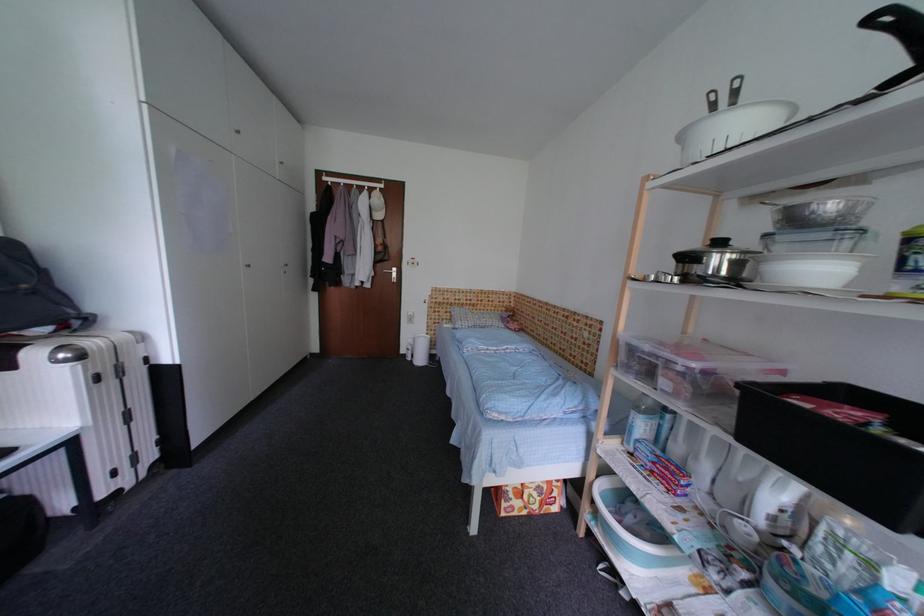
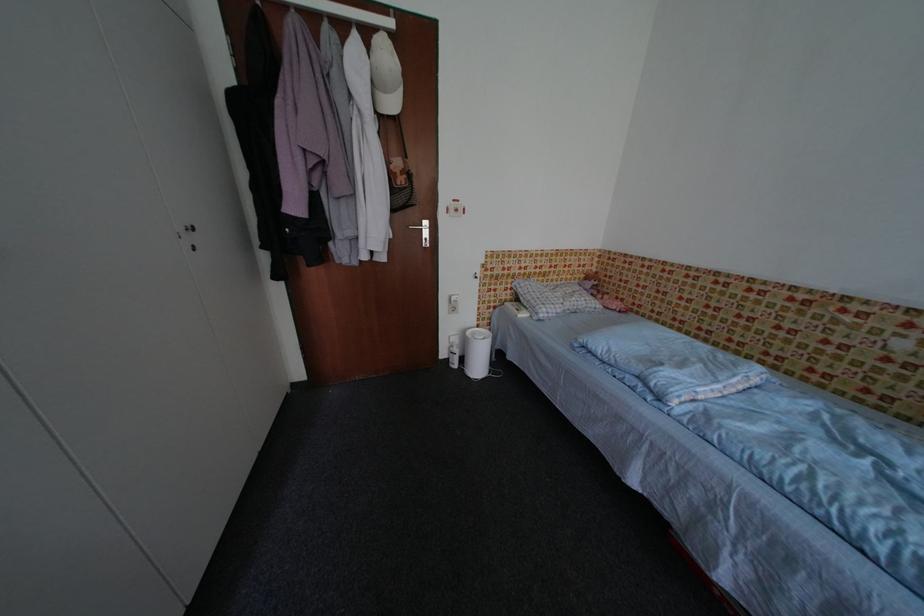
In the second image, find the point that corresponds to point 499,313 in the first image.

(574, 282)